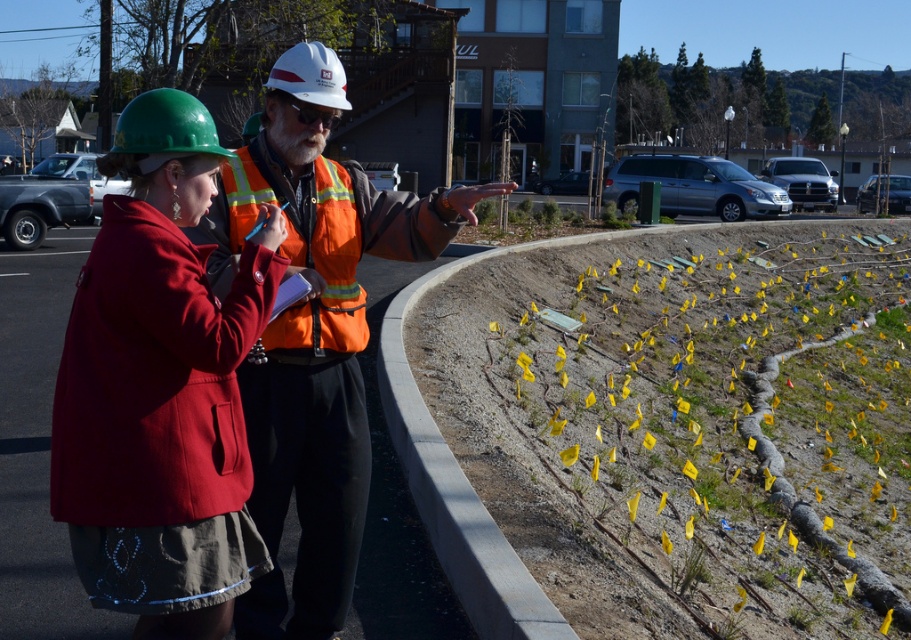
Based on the coordinates provided, which object is located at point (160, 387) in the image?

The point (160, 387) corresponds to the matte green hard hat at left.

You are a construction worker who needs to locate the reflective orange safety vest at center and the orange reflective safety vest at center in the image. Which one is positioned lower in the scene?

The reflective orange safety vest at center is positioned lower than the orange reflective safety vest at center.